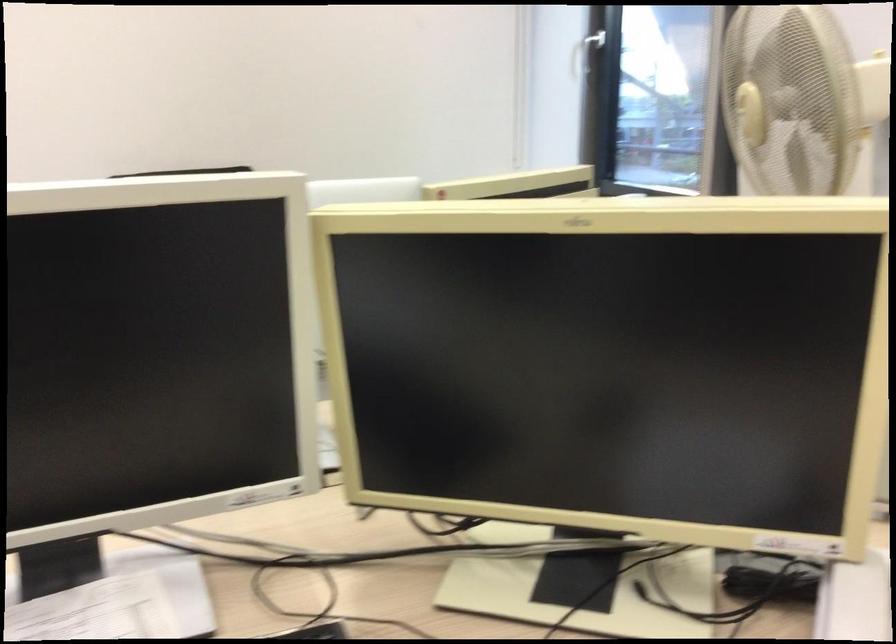
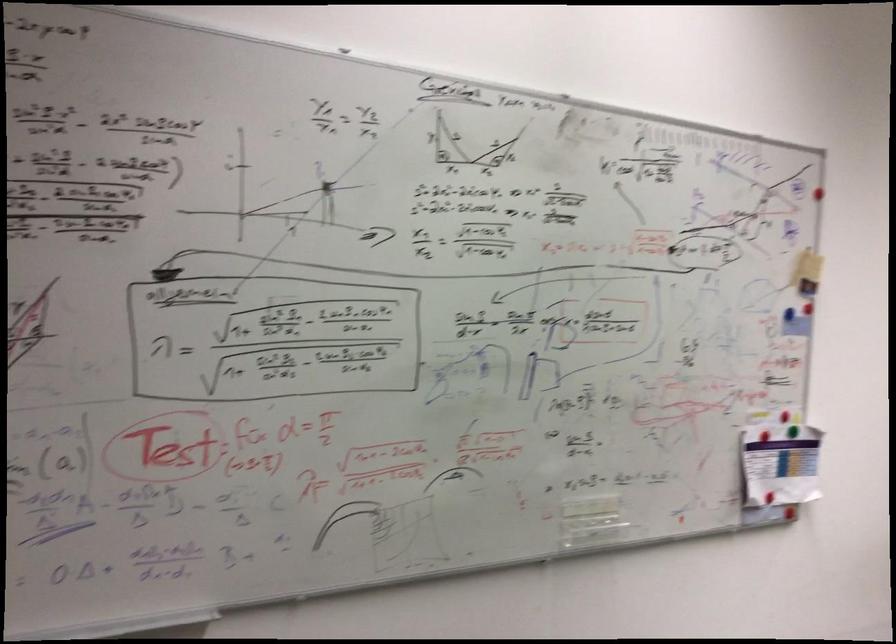
Question: Which direction would the cameraman need to move to produce the second image? Reply with the corresponding letter.

Choices:
 (A) Left
 (B) Right
 (C) Forward
 (D) Backward

Answer: (A)